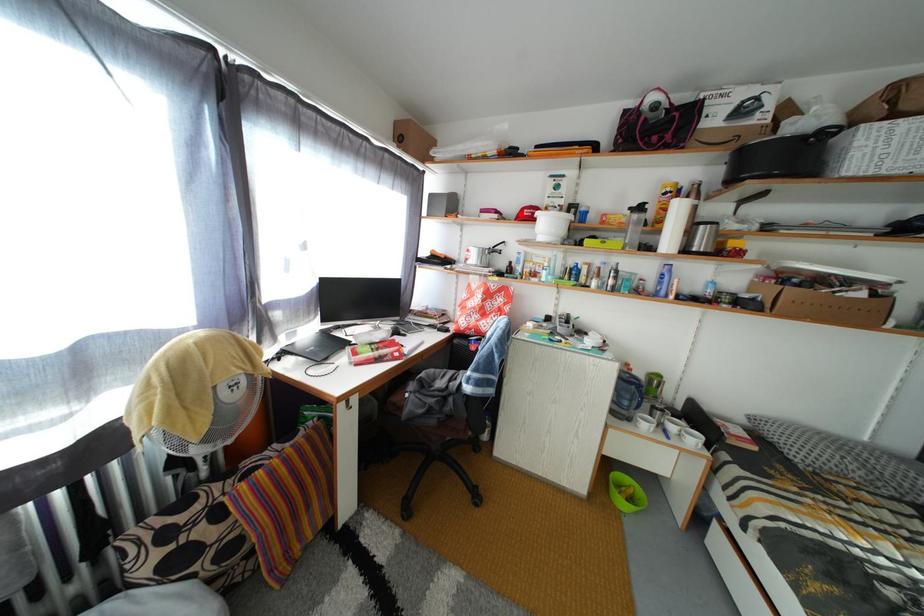
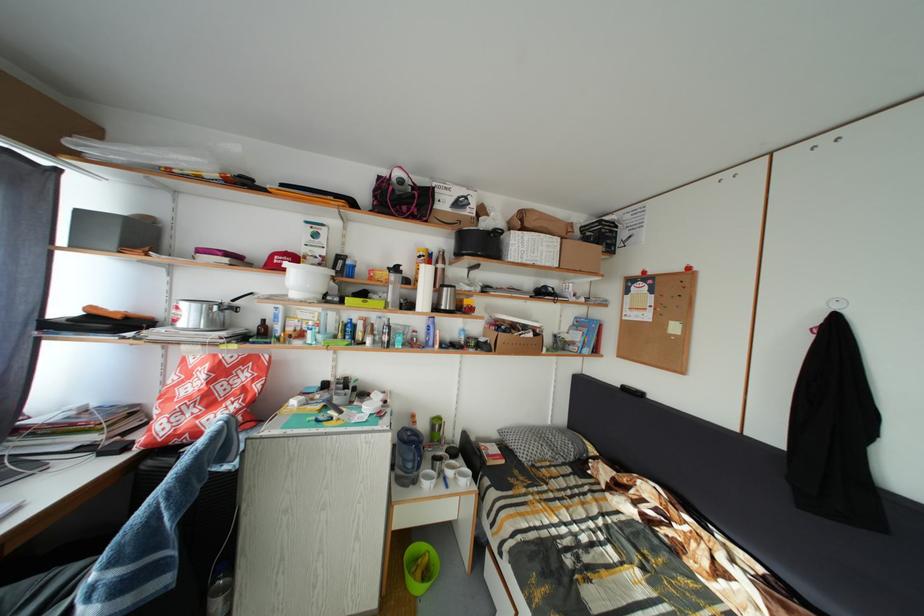
Question: I am providing you with two images of the same scene from different viewpoints. A red point is shown in image1. For the corresponding object point in image2, is it positioned nearer or farther from the camera?

Choices:
 (A) Nearer
 (B) Farther

Answer: (B)